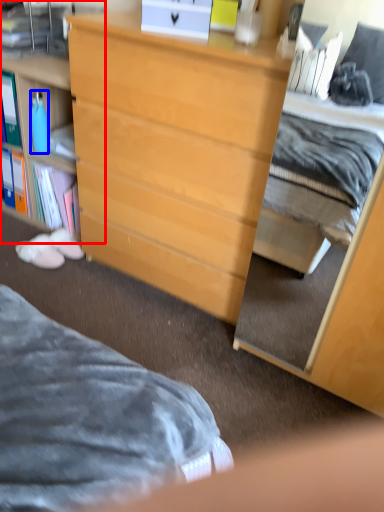
Question: Which of the following is the farthest to the observer, cabinetry (highlighted by a red box) or bottle (highlighted by a blue box)?

Choices:
 (A) cabinetry
 (B) bottle

Answer: (B)